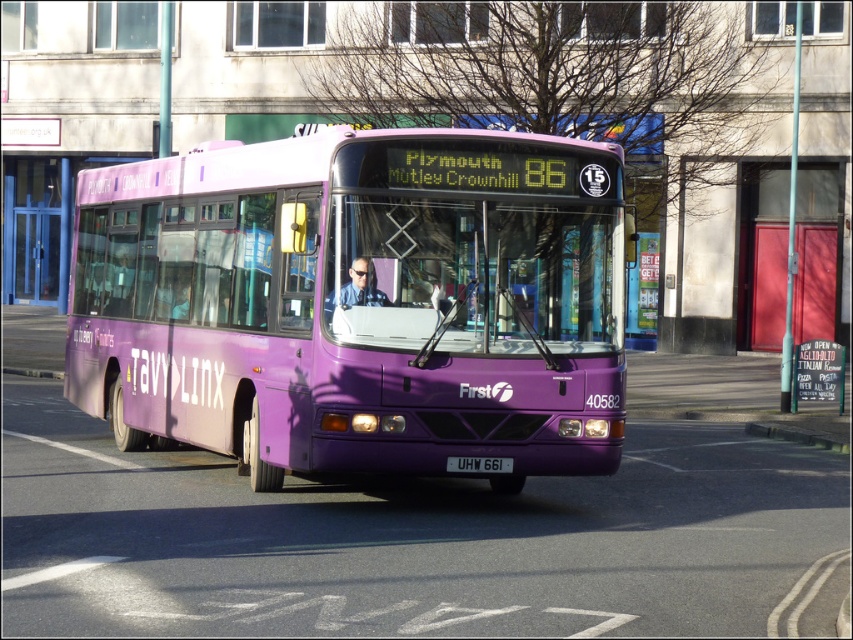
From the picture: You are a passenger on the purple bus and want to take a photo of the registration plate. You have two points on the bus where you can stand to take the photo. One is at point (x=492, y=396) and the other is at point (x=759, y=433). Which point should you choose to get a clearer photo of the registration plate?

You should choose point (x=492, y=396) to take the photo because it is closer to the camera than point (x=759, y=433), resulting in a clearer image.

You are a pedestrian standing on the sidewalk and see the matte purple bus at center and the black plastic license plate at center. Which object is higher from the ground?

The matte purple bus at center is above the black plastic license plate at center, so the matte purple bus at center is higher from the ground.

You are a photographer taking a picture of the purple bus. You notice the purple rubber curb at lower center and the black plastic license plate at center. Which object is higher up in the photo?

The purple rubber curb at lower center is taller than the black plastic license plate at center, so the purple rubber curb at lower center appears higher up in the photo.